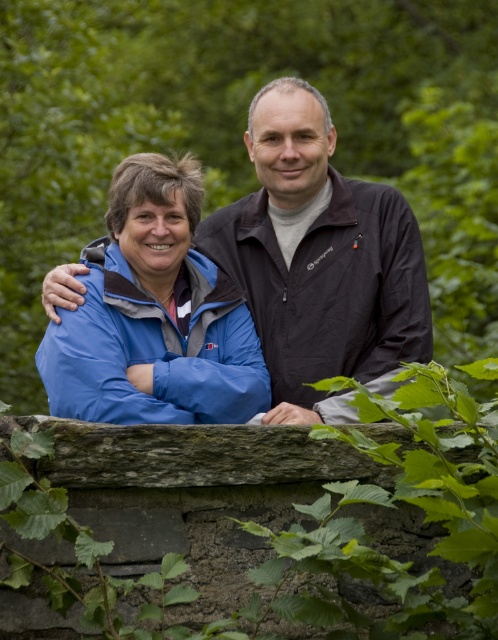
Who is positioned more to the right, blue fabric jacket at center or matte blue jacket at left?

Positioned to the right is blue fabric jacket at center.

Is blue fabric jacket at center wider than matte blue jacket at left?

No.

Locate an element on the screen. blue fabric jacket at center is located at coordinates (320, 260).